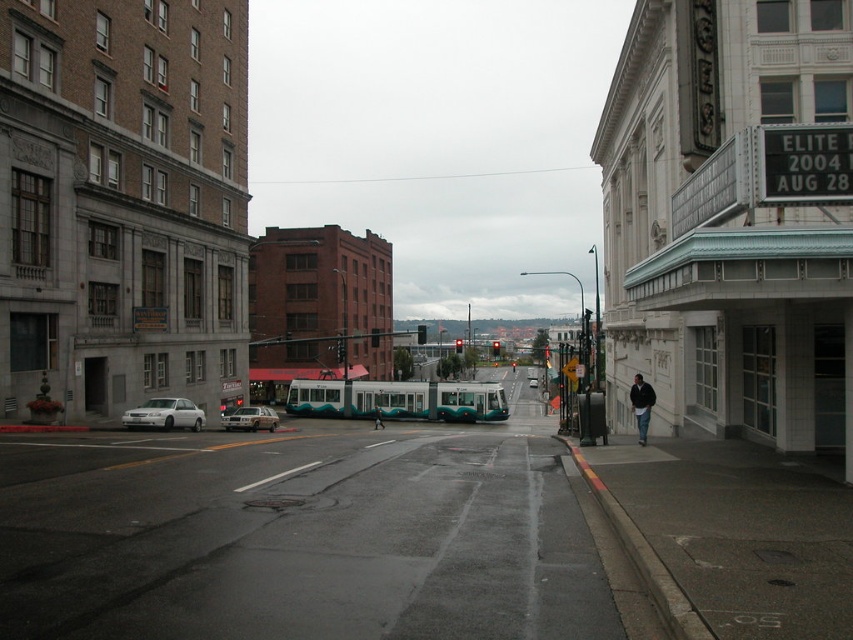
Is point (224, 416) farther from viewer compared to point (376, 410)?

No.

Is metallic silver sedan at center bigger than dark blue jeans at center?

Yes.

Where is `metallic silver sedan at center`? The width and height of the screenshot is (853, 640). metallic silver sedan at center is located at coordinates (250, 419).

Is teal matte bus at center bigger than metallic silver sedan at center?

Correct, teal matte bus at center is larger in size than metallic silver sedan at center.

Is point (422, 412) positioned before point (259, 426)?

No, (422, 412) is further to viewer.

The image size is (853, 640). What are the coordinates of `teal matte bus at center` in the screenshot? It's located at (398, 400).

Which of these two, white matte sedan at left or dark blue jacket at lower right, stands shorter?

white matte sedan at left

Can you confirm if white matte sedan at left is smaller than dark blue jacket at lower right?

Indeed, white matte sedan at left has a smaller size compared to dark blue jacket at lower right.

Is point (194, 428) positioned after point (653, 388)?

Yes.

Identify the location of white matte sedan at left. The image size is (853, 640). (165, 413).